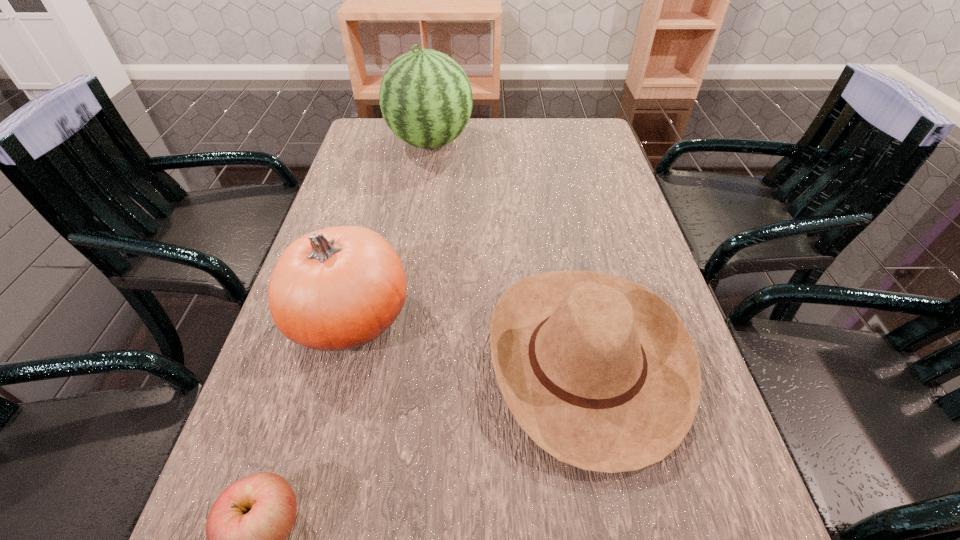
Locate an element on the screen. The width and height of the screenshot is (960, 540). the farthest object is located at coordinates (426, 99).

The image size is (960, 540). Identify the location of watermelon. (426, 99).

The height and width of the screenshot is (540, 960). I want to click on pumpkin, so click(338, 288).

Where is `the second shortest object`? the second shortest object is located at coordinates (600, 372).

Find the location of a particular element. The width and height of the screenshot is (960, 540). the rightmost object is located at coordinates (600, 372).

This screenshot has height=540, width=960. I want to click on vacant space located on the right of the farthest object, so click(x=513, y=143).

You are a GUI agent. You are given a task and a screenshot of the screen. Output one action in this format:
    pyautogui.click(x=<x>, y=<y>)
    Task: Click on the free spot located 0.370m on the back of the second tallest object
    This screenshot has height=540, width=960.
    Given the screenshot: What is the action you would take?
    pyautogui.click(x=387, y=179)

Where is `vacant area located on the front-facing side of the rightmost object`? This screenshot has height=540, width=960. vacant area located on the front-facing side of the rightmost object is located at coordinates (326, 359).

The width and height of the screenshot is (960, 540). I want to click on vacant space located 0.400m on the front-facing side of the rightmost object, so click(x=273, y=359).

The height and width of the screenshot is (540, 960). In order to click on free location located 0.140m on the front-facing side of the rightmost object in this screenshot , I will do `click(414, 359)`.